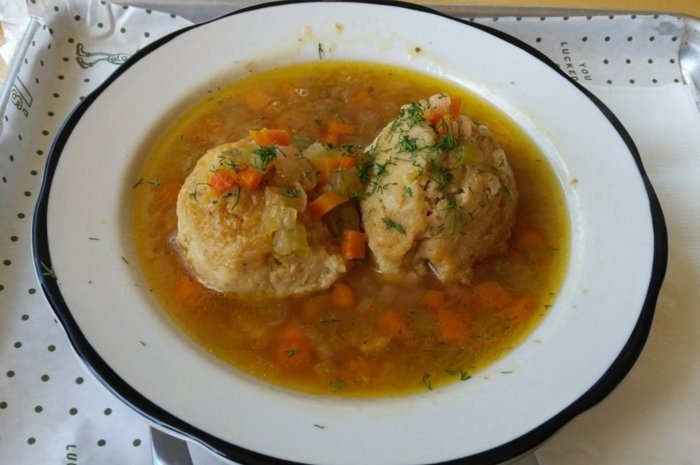
The height and width of the screenshot is (465, 700). In order to click on side of tray in this screenshot , I will do `click(18, 56)`.